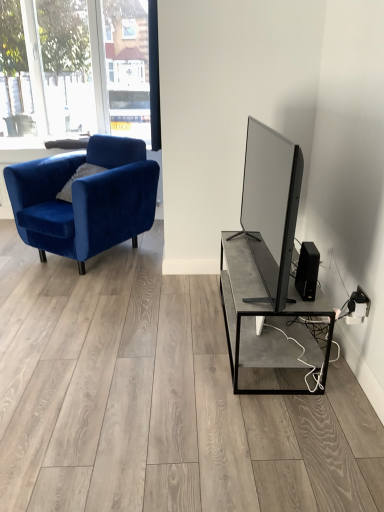
You are a GUI agent. You are given a task and a screenshot of the screen. Output one action in this format:
    pyautogui.click(x=<x>, y=<y>)
    Task: Click on the velvet blue armchair at left
    Image resolution: width=384 pixels, height=512 pixels.
    Given the screenshot: What is the action you would take?
    pyautogui.click(x=85, y=199)

Measure the distance between velvet blue armchair at left and camera.

They are 2.67 meters apart.

Describe the element at coordinates (85, 199) in the screenshot. I see `velvet blue armchair at left` at that location.

Locate an element on the screen. The image size is (384, 512). black matte speaker at lower right is located at coordinates (307, 271).

What do you see at coordinates (307, 271) in the screenshot? The width and height of the screenshot is (384, 512). I see `black matte speaker at lower right` at bounding box center [307, 271].

This screenshot has height=512, width=384. Find the location of `velvet blue armchair at left`. velvet blue armchair at left is located at coordinates (85, 199).

Can you confirm if velvet blue armchair at left is positioned to the right of black matte speaker at lower right?

No, velvet blue armchair at left is not to the right of black matte speaker at lower right.

Is velvet blue armchair at left behind black matte speaker at lower right?

Yes.

Is point (87, 155) closer or farther from the camera than point (300, 269)?

Point (87, 155) is farther from the camera than point (300, 269).

From the image's perspective, is velvet blue armchair at left located above or below black matte speaker at lower right?

Based on their image positions, velvet blue armchair at left is located above black matte speaker at lower right.

From a real-world perspective, is velvet blue armchair at left above or below black matte speaker at lower right?

velvet blue armchair at left is situated lower than black matte speaker at lower right in the real world.

Looking at their sizes, would you say velvet blue armchair at left is wider or thinner than black matte speaker at lower right?

velvet blue armchair at left is wider than black matte speaker at lower right.

Is velvet blue armchair at left taller or shorter than black matte speaker at lower right?

velvet blue armchair at left is taller than black matte speaker at lower right.

In terms of size, does velvet blue armchair at left appear bigger or smaller than black matte speaker at lower right?

In the image, velvet blue armchair at left appears to be larger than black matte speaker at lower right.

Do you think velvet blue armchair at left is within black matte speaker at lower right, or outside of it?

velvet blue armchair at left is outside black matte speaker at lower right.

Is velvet blue armchair at left far from black matte speaker at lower right?

velvet blue armchair at left is far away from black matte speaker at lower right.

Is velvet blue armchair at left facing away from black matte speaker at lower right?

No, velvet blue armchair at left is not facing the opposite direction of black matte speaker at lower right.

Can you tell me how much velvet blue armchair at left and black matte speaker at lower right differ in facing direction?

There is a 63-degree angle between the facing directions of velvet blue armchair at left and black matte speaker at lower right.

You are a GUI agent. You are given a task and a screenshot of the screen. Output one action in this format:
    pyautogui.click(x=<x>, y=<y>)
    Task: Click on the speaker lying on the right of velvet blue armchair at left
    The width and height of the screenshot is (384, 512).
    Given the screenshot: What is the action you would take?
    pyautogui.click(x=307, y=271)

Would you say black matte speaker at lower right is to the left or to the right of velvet blue armchair at left in the picture?

In the image, black matte speaker at lower right appears on the right side of velvet blue armchair at left.

Which object is further away from the camera taking this photo, black matte speaker at lower right or velvet blue armchair at left?

velvet blue armchair at left is behind.

Is point (305, 269) positioned after point (69, 241)?

No, it is in front of (69, 241).

From the image's perspective, is black matte speaker at lower right on top of velvet blue armchair at left?

No.

From a real-world perspective, is black matte speaker at lower right on velvet blue armchair at left?

Indeed, from a real-world perspective, black matte speaker at lower right stands above velvet blue armchair at left.

Which object is thinner, black matte speaker at lower right or velvet blue armchair at left?

With smaller width is black matte speaker at lower right.

Does black matte speaker at lower right have a greater height compared to velvet blue armchair at left?

No.

In terms of size, does black matte speaker at lower right appear bigger or smaller than velvet blue armchair at left?

Clearly, black matte speaker at lower right is smaller in size than velvet blue armchair at left.

Can we say black matte speaker at lower right lies outside velvet blue armchair at left?

Yes, black matte speaker at lower right is not within velvet blue armchair at left.

Is black matte speaker at lower right in contact with velvet blue armchair at left?

No, black matte speaker at lower right is not with velvet blue armchair at left.

Is black matte speaker at lower right looking in the opposite direction of velvet blue armchair at left?

No.

The height and width of the screenshot is (512, 384). In the image, there is a black matte speaker at lower right. In order to click on chair below it (from a real-world perspective) in this screenshot , I will do `click(85, 199)`.

This screenshot has width=384, height=512. Identify the location of speaker below the velvet blue armchair at left (from the image's perspective). (307, 271).

Find the location of `speaker positioned vertically above the velvet blue armchair at left (from a real-world perspective)`. speaker positioned vertically above the velvet blue armchair at left (from a real-world perspective) is located at coordinates (307, 271).